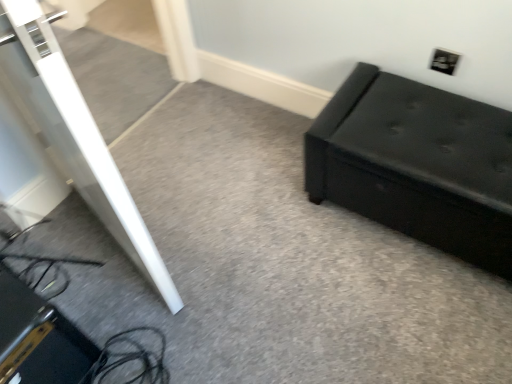
Question: Considering the positions of black plastic electric outlet at upper right and black leather ottoman at right in the image, is black plastic electric outlet at upper right bigger or smaller than black leather ottoman at right?

Choices:
 (A) small
 (B) big

Answer: (A)

Question: Is black plastic electric outlet at upper right to the left or to the right of black leather ottoman at right in the image?

Choices:
 (A) left
 (B) right

Answer: (B)

Question: Relative to black leather ottoman at right, is black plastic electric outlet at upper right in front or behind?

Choices:
 (A) front
 (B) behind

Answer: (B)

Question: Considering the positions of black leather ottoman at right and black plastic electric outlet at upper right in the image, is black leather ottoman at right wider or thinner than black plastic electric outlet at upper right?

Choices:
 (A) wide
 (B) thin

Answer: (A)

Question: Is black leather ottoman at right inside the boundaries of black plastic electric outlet at upper right, or outside?

Choices:
 (A) outside
 (B) inside

Answer: (A)

Question: From a real-world perspective, is black leather ottoman at right above or below black plastic electric outlet at upper right?

Choices:
 (A) above
 (B) below

Answer: (B)

Question: Is point (502, 230) closer or farther from the camera than point (439, 66)?

Choices:
 (A) farther
 (B) closer

Answer: (B)